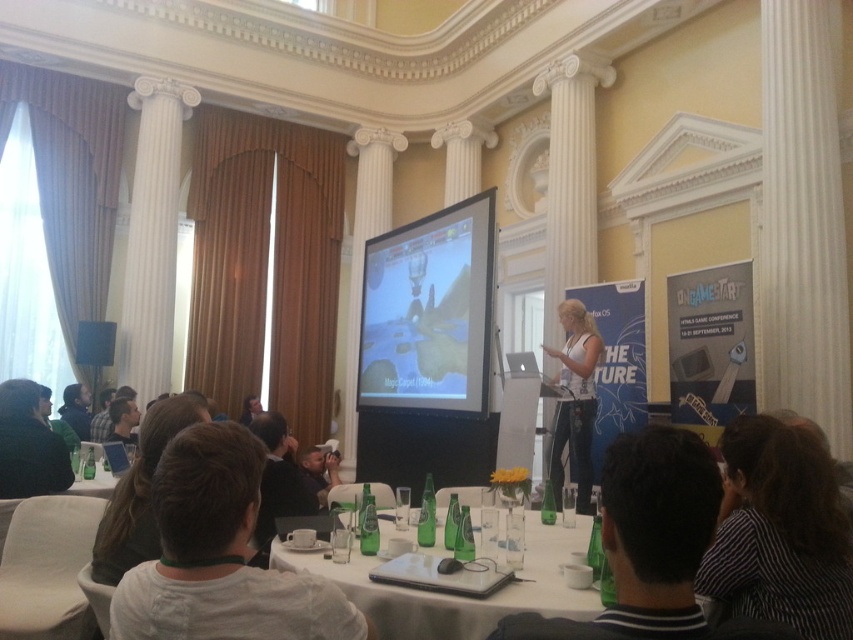
You are a server at a formal event and need to move from the black striped shirt at lower right to the green glass bottles at lower left to refill a drink. Given that you can carry a tray with both hands, what is the minimum distance you need to cover to reach the bottles from the shirt?

The minimum distance between the black striped shirt at lower right and the green glass bottles at lower left is 3.50 meters, so you need to cover at least 3.50 meters to reach the bottles from the shirt.

You are organizing a photoshoot and need to place a 1.2 meter wide backdrop between the black striped shirt at lower right and the white matte tank top at center. Will the backdrop fit between them?

The black striped shirt at lower right has a lesser width compared to white matte tank top at center, so the total width between them may vary. However, since the backdrop is 1.2 meters wide, it depends on the actual distance between the two objects. The given information only specifies the width comparison between the shirts, not the distance between them. Therefore, we cannot determine if the backdrop will fit based on the provided details.